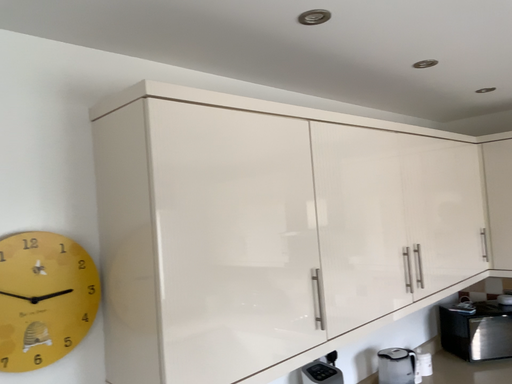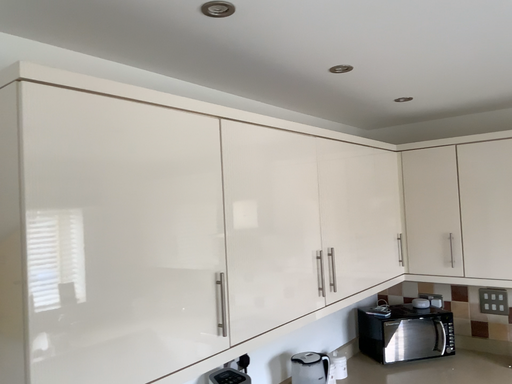
Question: Which way did the camera rotate in the video?

Choices:
 (A) rotated left
 (B) rotated right

Answer: (B)